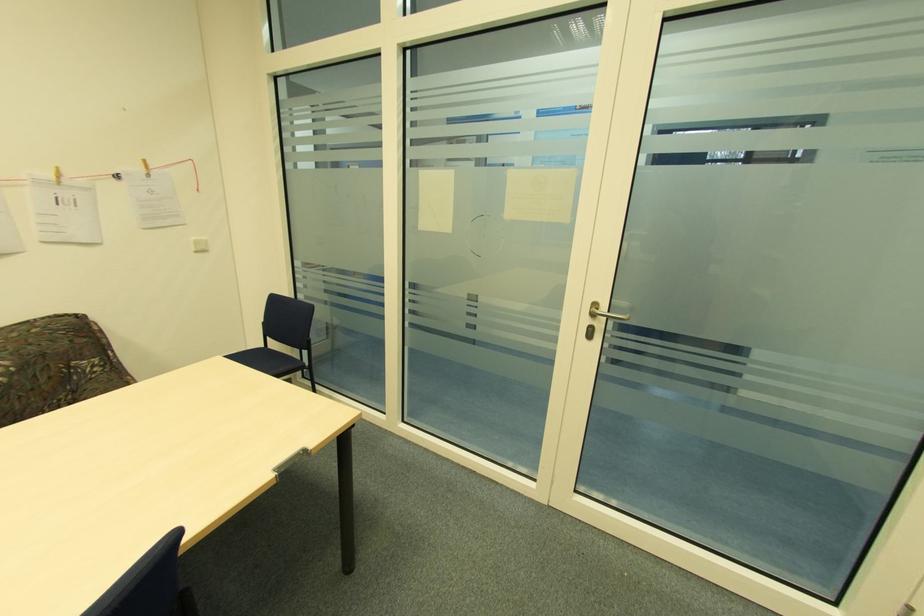
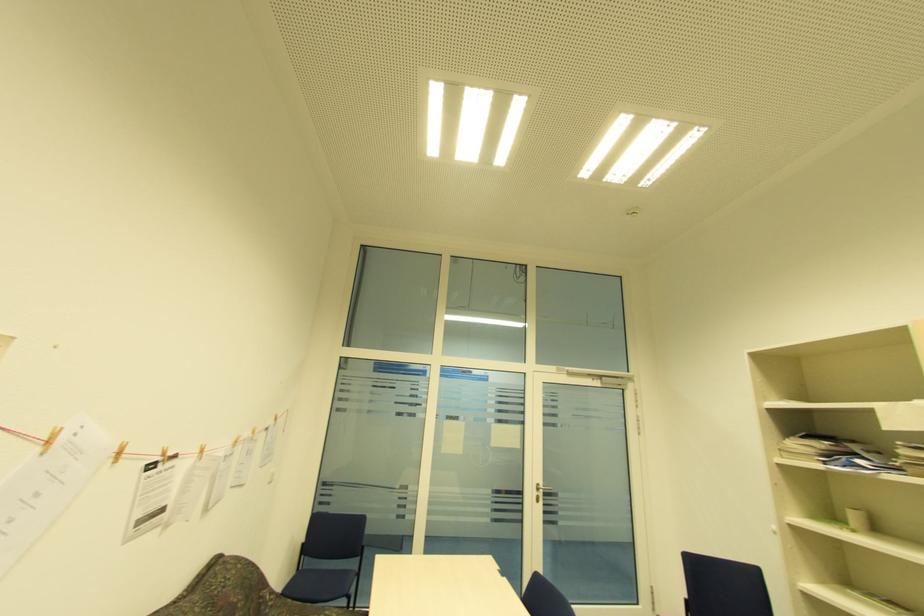
Locate, in the second image, the point that corresponds to [589,321] in the first image.

(538, 493)